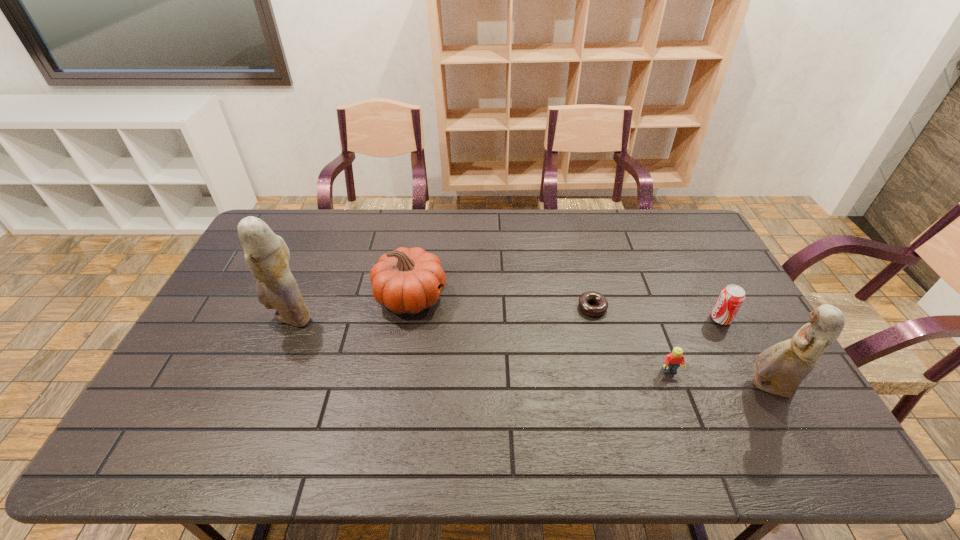
Where is `free space between the Lego and the tallest object`? free space between the Lego and the tallest object is located at coordinates (480, 345).

Find the location of a particular element. free spot between the soda can and the leftmost object is located at coordinates (506, 318).

Identify the location of vacant region between the soda can and the pumpkin. The height and width of the screenshot is (540, 960). (565, 308).

Identify the location of free spot between the soda can and the taller figurine. Image resolution: width=960 pixels, height=540 pixels. (506, 318).

This screenshot has width=960, height=540. What are the coordinates of `empty location between the second shortest object and the soda can` in the screenshot? It's located at (695, 345).

Locate an element on the screen. The width and height of the screenshot is (960, 540). free spot between the Lego and the fifth object from right to left is located at coordinates (540, 334).

At what (x,y) coordinates should I click in order to perform the action: click on free spot between the pumpkin and the third shortest object. Please return your answer as a coordinate pair (x, y). The width and height of the screenshot is (960, 540). Looking at the image, I should click on (565, 308).

I want to click on vacant space that's between the taller figurine and the fourth object from left to right, so click(x=480, y=345).

Where is `the third closest object to the tallest object`? The height and width of the screenshot is (540, 960). the third closest object to the tallest object is located at coordinates (672, 361).

Identify which object is located as the third nearest to the taller figurine. Please provide its 2D coordinates. Your answer should be formatted as a tuple, i.e. [(x, y)], where the tuple contains the x and y coordinates of a point satisfying the conditions above.

[(672, 361)]